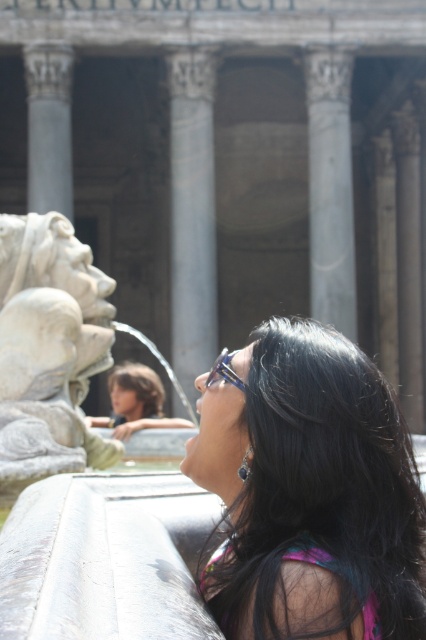
Question: Can you confirm if gray marble pillar at center is positioned to the left of smooth stone column at center?

Choices:
 (A) no
 (B) yes

Answer: (B)

Question: Which point appears closest to the camera in this image?

Choices:
 (A) (351, 209)
 (B) (46, 241)
 (C) (233, 604)
 (D) (230, 372)

Answer: (C)

Question: Does white marble column at center appear under shiny blue glasses at center?

Choices:
 (A) yes
 (B) no

Answer: (B)

Question: Does shiny black sunglasses at center have a greater width compared to white stone lion at left?

Choices:
 (A) no
 (B) yes

Answer: (A)

Question: Which is nearer to the smooth stone column at center?

Choices:
 (A) white stone lion at left
 (B) shiny blue glasses at center

Answer: (B)

Question: Which point appears farthest from the camera in this image?

Choices:
 (A) (187, 224)
 (B) (89, 316)
 (C) (241, 388)
 (D) (244, 492)

Answer: (A)